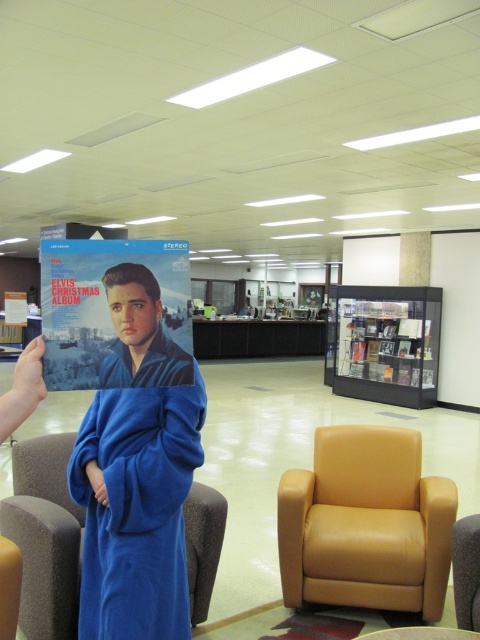
Does point (379, 582) come behind point (374, 401)?

No.

Is point (406, 534) positioned behind point (328, 378)?

No, it is in front of (328, 378).

Identify the location of tan leather armchair at lower right. This screenshot has width=480, height=640. (365, 524).

Who is lower down, blue fleece robe at center or transparent glass bookshelf at center?

blue fleece robe at center is lower down.

Can you confirm if blue fleece robe at center is positioned to the left of transparent glass bookshelf at center?

Yes, blue fleece robe at center is to the left of transparent glass bookshelf at center.

At what (x,y) coordinates should I click in order to perform the action: click on blue fleece robe at center. Please return your answer as a coordinate pair (x, y). Image resolution: width=480 pixels, height=640 pixels. Looking at the image, I should click on (135, 508).

At what (x,y) coordinates should I click in order to perform the action: click on blue fleece robe at center. Please return your answer as a coordinate pair (x, y). Looking at the image, I should click on pos(135,508).

Who is more forward, (414, 480) or (180, 376)?

Point (180, 376)

Which is in front, point (316, 540) or point (84, 252)?

Point (84, 252)

Locate an element on the screen. The image size is (480, 640). tan leather armchair at lower right is located at coordinates (365, 524).